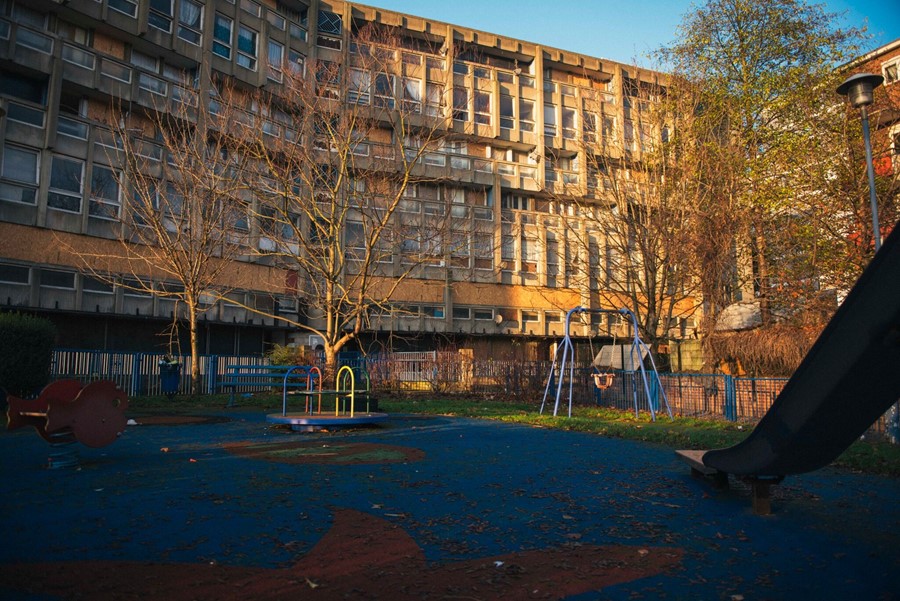
Image resolution: width=900 pixels, height=601 pixels. I want to click on trashcan, so click(164, 370).